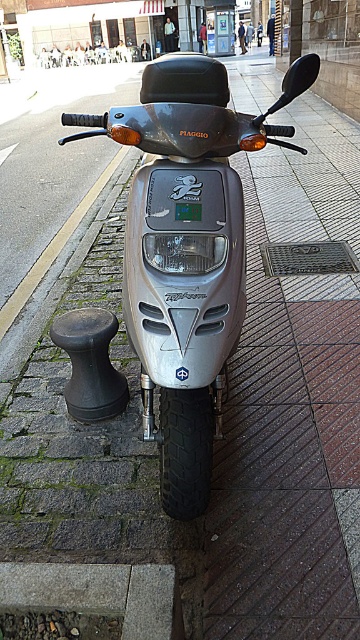
Question: Does gray concrete curb at lower left have a larger size compared to green plastic license plate at center?

Choices:
 (A) no
 (B) yes

Answer: (B)

Question: Can you confirm if gray concrete curb at lower left is bigger than green plastic license plate at center?

Choices:
 (A) no
 (B) yes

Answer: (B)

Question: From the image, what is the correct spatial relationship of gray concrete curb at lower left in relation to green plastic license plate at center?

Choices:
 (A) below
 (B) above

Answer: (A)

Question: Among these objects, which one is farthest from the camera?

Choices:
 (A) gray concrete curb at lower left
 (B) green plastic license plate at center

Answer: (B)

Question: Which point is farther from the camera taking this photo?

Choices:
 (A) (192, 216)
 (B) (129, 612)

Answer: (A)